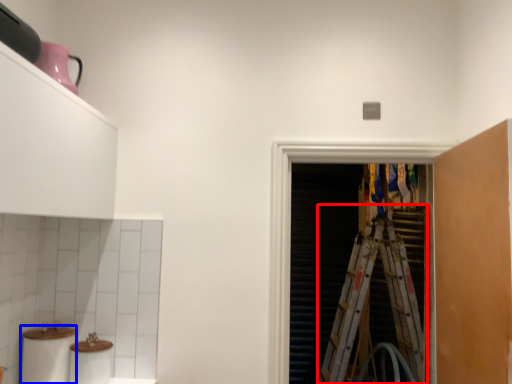
Question: Which object is further to the camera taking this photo, ladder (highlighted by a red box) or toilet paper (highlighted by a blue box)?

Choices:
 (A) ladder
 (B) toilet paper

Answer: (A)